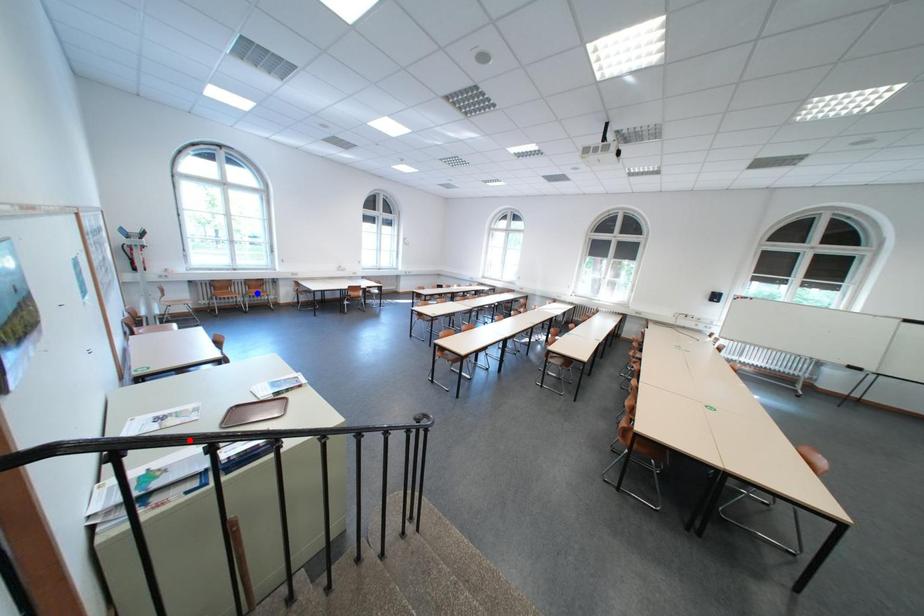
Question: Which of the two points in the image is closer to the camera?

Choices:
 (A) Blue point is closer.
 (B) Red point is closer.

Answer: (B)